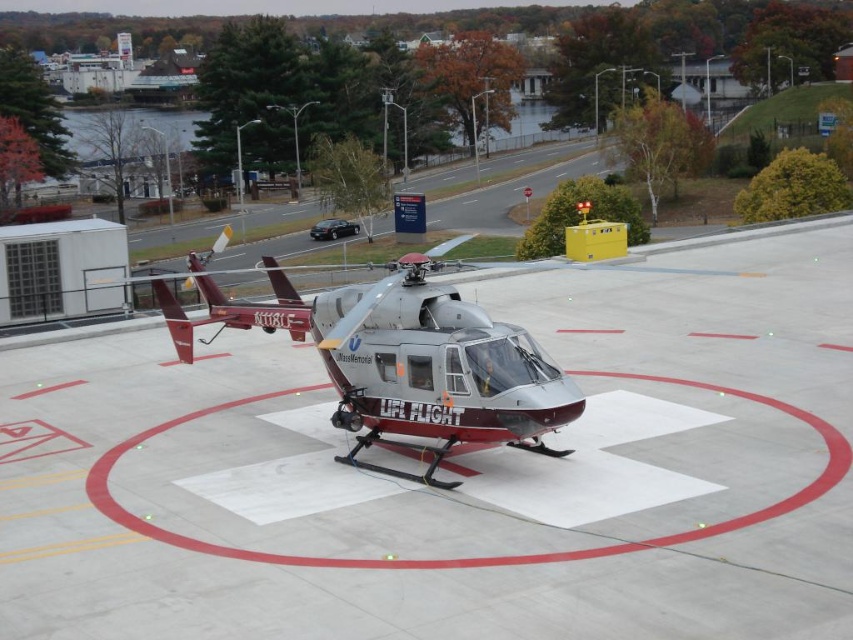
The width and height of the screenshot is (853, 640). What do you see at coordinates (457, 472) in the screenshot?
I see `smooth concrete tarmac at center` at bounding box center [457, 472].

Based on the photo, who is more forward, (142,582) or (219,298)?

Point (142,582)

Identify the location of smooth concrete tarmac at center. This screenshot has height=640, width=853. (457, 472).